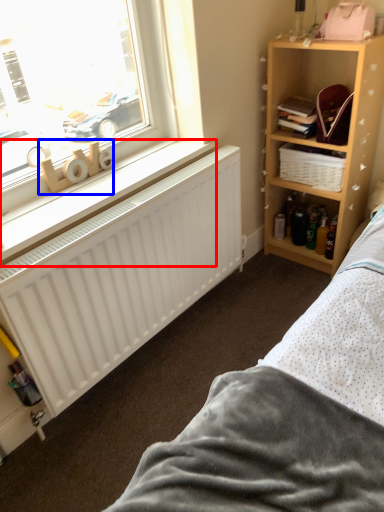
Question: Among these objects, which one is nearest to the camera, window sill (highlighted by a red box) or toy (highlighted by a blue box)?

Choices:
 (A) window sill
 (B) toy

Answer: (A)